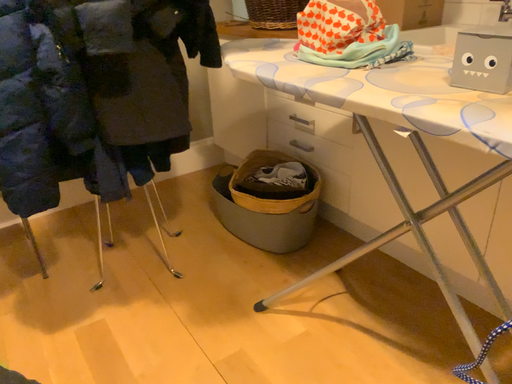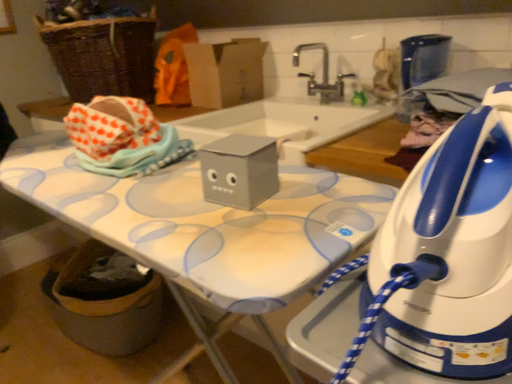
Question: Which way did the camera rotate in the video?

Choices:
 (A) rotated upward
 (B) rotated downward

Answer: (A)